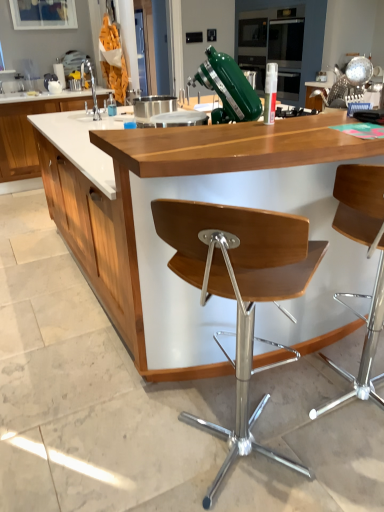
Find the location of a particular element. The height and width of the screenshot is (512, 384). free spot to the left of wooden chair at center, which is the second chair from right to left is located at coordinates (105, 454).